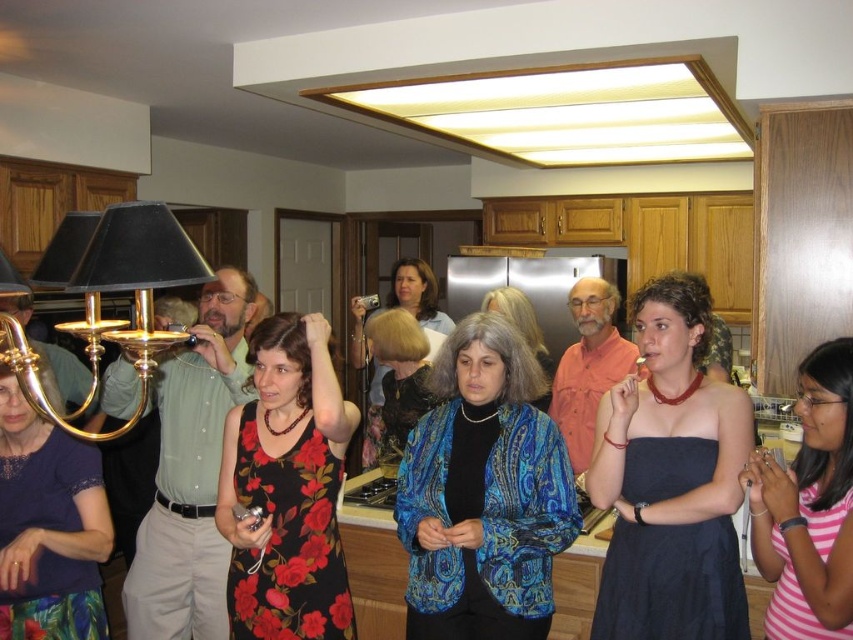
The width and height of the screenshot is (853, 640). What do you see at coordinates (670, 481) in the screenshot? I see `matte black dress at center` at bounding box center [670, 481].

Between matte black dress at center and matte purple blouse at center, which one appears on the left side from the viewer's perspective?

matte purple blouse at center

The width and height of the screenshot is (853, 640). What do you see at coordinates (670, 481) in the screenshot?
I see `matte black dress at center` at bounding box center [670, 481].

Identify the location of matte black dress at center. The height and width of the screenshot is (640, 853). (670, 481).

Can you confirm if pink striped dress at lower right is positioned to the left of gold brass chandelier at upper left?

No, pink striped dress at lower right is not to the left of gold brass chandelier at upper left.

Between pink striped dress at lower right and gold brass chandelier at upper left, which one is positioned higher?

Positioned higher is gold brass chandelier at upper left.

The image size is (853, 640). Describe the element at coordinates (808, 506) in the screenshot. I see `pink striped dress at lower right` at that location.

Locate an element on the screen. pink striped dress at lower right is located at coordinates (808, 506).

Can you confirm if matte purple blouse at center is positioned to the right of gold brass chandelier at upper left?

Incorrect, matte purple blouse at center is not on the right side of gold brass chandelier at upper left.

Does matte purple blouse at center appear on the left side of gold brass chandelier at upper left?

Indeed, matte purple blouse at center is positioned on the left side of gold brass chandelier at upper left.

Who is more distant from viewer, [80,609] or [172,285]?

The point [80,609] is more distant.

This screenshot has width=853, height=640. Find the location of `matte purple blouse at center`. matte purple blouse at center is located at coordinates (48, 525).